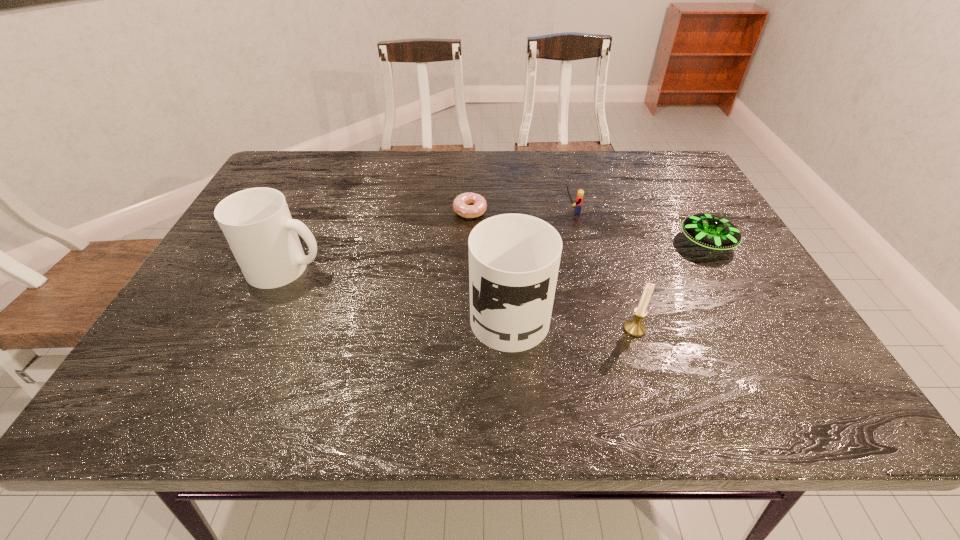
Locate an element on the screen. This screenshot has width=960, height=540. the left mug is located at coordinates (257, 224).

Where is `the second tallest object`? The height and width of the screenshot is (540, 960). the second tallest object is located at coordinates (257, 224).

At what (x,y) coordinates should I click in order to perform the action: click on the tallest object. Please return your answer as a coordinate pair (x, y). This screenshot has width=960, height=540. Looking at the image, I should click on (514, 259).

Where is `the taller mug`? Image resolution: width=960 pixels, height=540 pixels. the taller mug is located at coordinates (514, 259).

This screenshot has height=540, width=960. What are the coordinates of `the fourth tallest object` in the screenshot? It's located at (579, 199).

The width and height of the screenshot is (960, 540). Find the location of `the fourth object from left to right`. the fourth object from left to right is located at coordinates (579, 199).

The width and height of the screenshot is (960, 540). I want to click on the shortest object, so click(x=461, y=203).

Find the location of `the rightmost object`. the rightmost object is located at coordinates (709, 231).

Locate an element on the screen. the fifth tallest object is located at coordinates (709, 231).

Locate an element on the screen. Image resolution: width=960 pixels, height=540 pixels. candle holder is located at coordinates (635, 327).